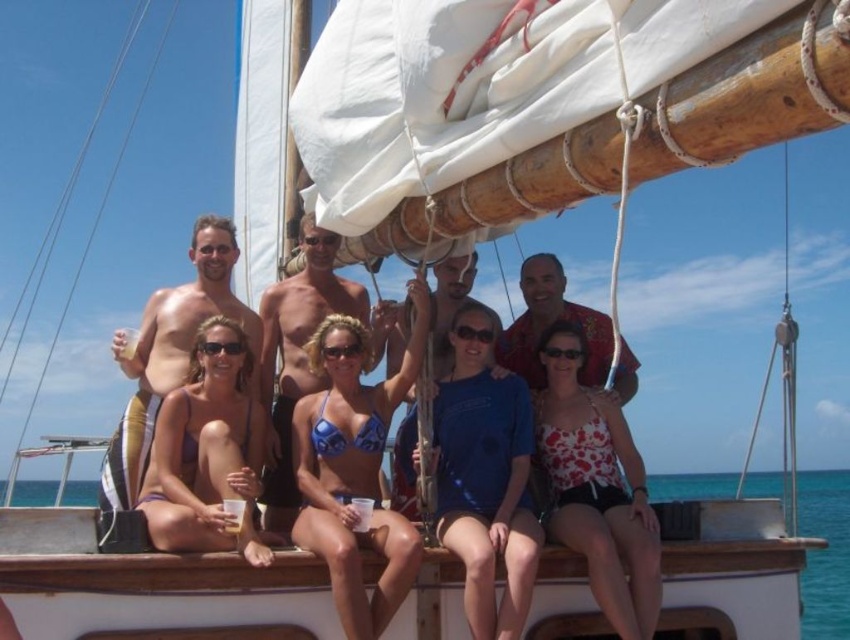
Is smooth tan skin at center smaller than blue shirt at center?

No.

Can you confirm if smooth tan skin at center is positioned to the right of blue shirt at center?

In fact, smooth tan skin at center is to the left of blue shirt at center.

Is point (146, 316) less distant than point (408, 470)?

That is False.

What are the coordinates of `smooth tan skin at center` in the screenshot? It's located at (170, 352).

Is blue bikini at center further to the viewer compared to shiny metallic torso at center?

No, it is in front of shiny metallic torso at center.

Is point (316, 525) positioned in front of point (320, 378)?

Yes.

The width and height of the screenshot is (850, 640). In order to click on blue bikini at center in this screenshot , I will do `click(354, 467)`.

Does floral shirt at center appear on the right side of blue shirt at center?

Correct, you'll find floral shirt at center to the right of blue shirt at center.

Between point (531, 333) and point (406, 449), which one is positioned in front?

Point (406, 449) is more forward.

Locate an element on the screen. floral shirt at center is located at coordinates (551, 323).